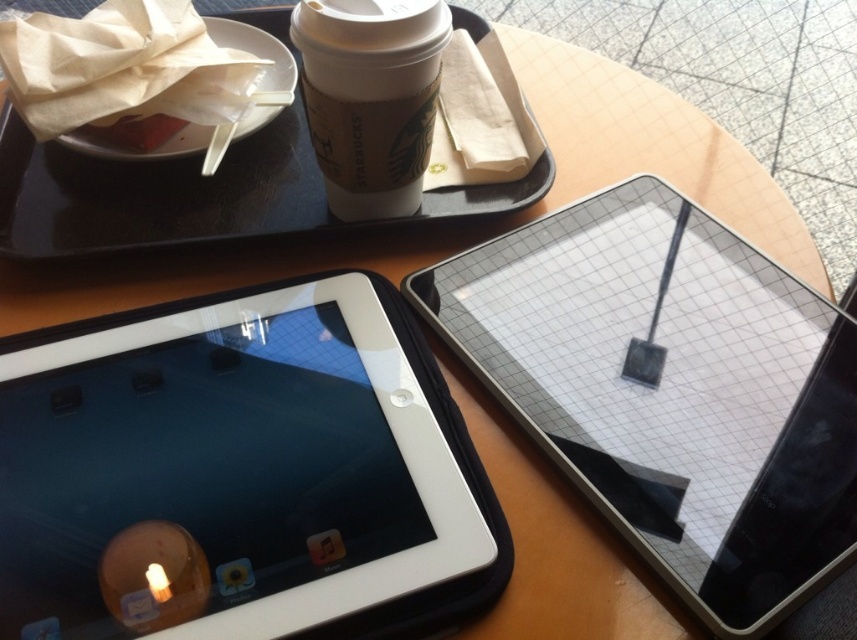
You are a barista at a coffee shop and need to place a new cup of coffee on the table. The table already has a black plastic tray at upper center and a white paper cup at upper center. Which object should you place the new cup next to to ensure it fits without overlapping?

The black plastic tray at upper center is larger in size than the white paper cup at upper center, so placing the new cup next to the black plastic tray at upper center would provide more space and prevent overlapping.

What object is located at the point with coordinates (670, 392)?

The black glossy tablet at center is located at the point with coordinates (670, 392).

You are a delivery person who needs to place a 30 cm wide package between the point at (268,145) and another point. Is there enough space?

The distance between the two points is 55.19 centimeters, which is more than the 30 cm width of the package. Therefore, there is enough space to place the package between them.